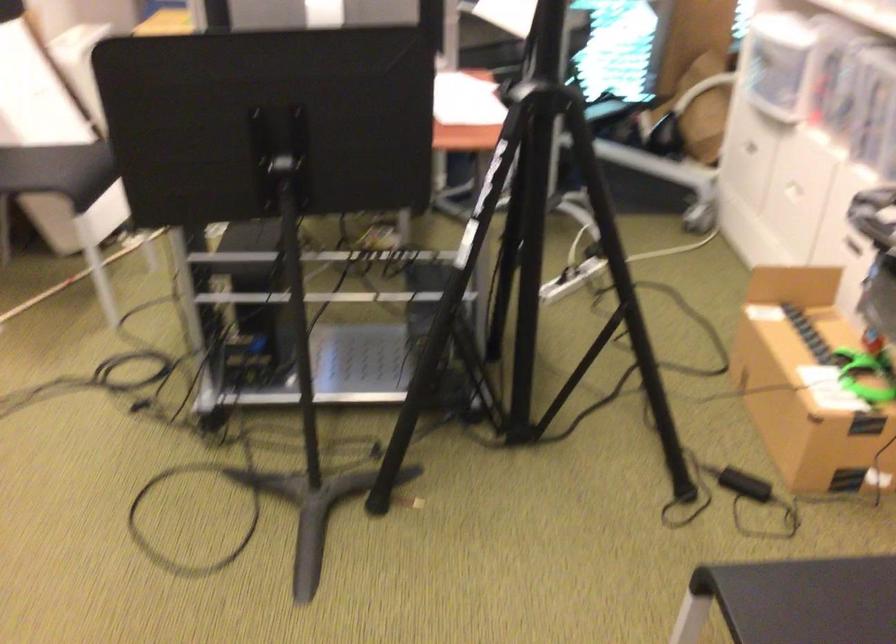
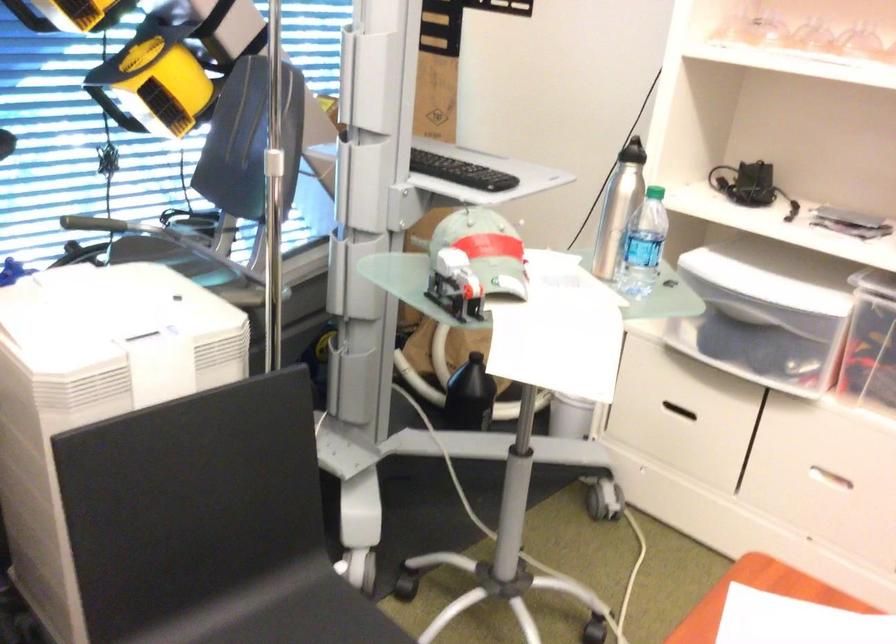
Locate, in the second image, the point that corresponds to point (774, 176) in the first image.

(832, 478)